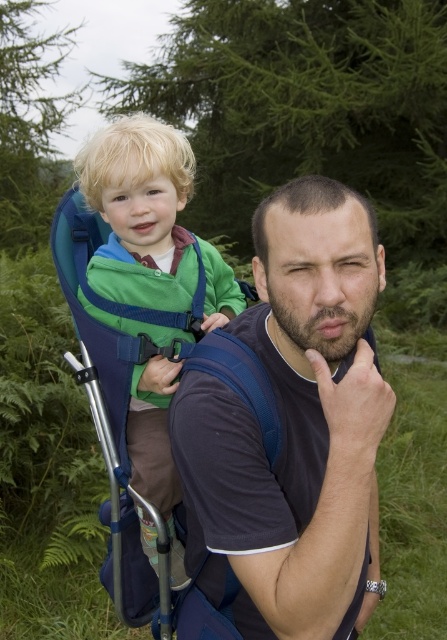
Question: Which point is farther from the camera taking this photo?

Choices:
 (A) pos(277,400)
 (B) pos(138,477)

Answer: (B)

Question: Considering the relative positions of dark blue fabric shirt at center and green fabric carrier at left in the image provided, where is dark blue fabric shirt at center located with respect to green fabric carrier at left?

Choices:
 (A) below
 (B) above

Answer: (A)

Question: Which of the following is the closest to the observer?

Choices:
 (A) dark blue fabric shirt at center
 (B) green fabric carrier at left

Answer: (A)

Question: Does dark blue fabric shirt at center appear under green fabric carrier at left?

Choices:
 (A) yes
 (B) no

Answer: (A)

Question: Observing the image, what is the correct spatial positioning of dark blue fabric shirt at center in reference to green fabric carrier at left?

Choices:
 (A) below
 (B) above

Answer: (A)

Question: Which point is closer to the camera?

Choices:
 (A) (178, 486)
 (B) (177, 396)

Answer: (B)